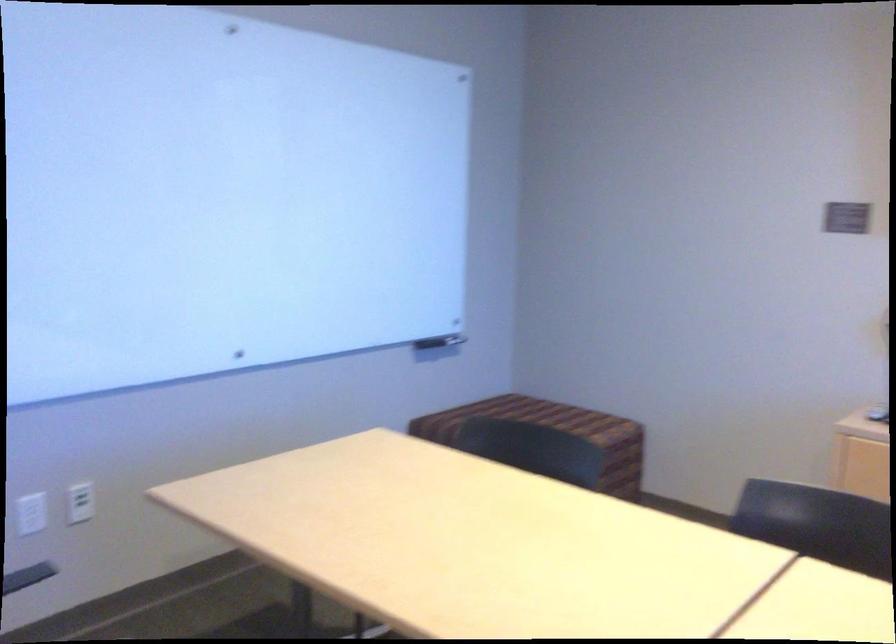
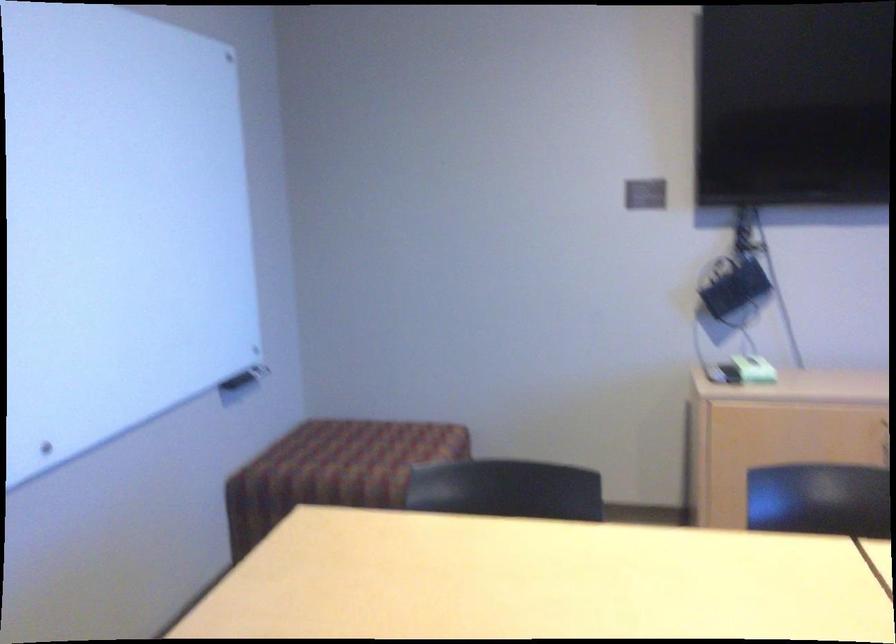
The point at (446, 336) is marked in the first image. Where is the corresponding point in the second image?

(246, 373)